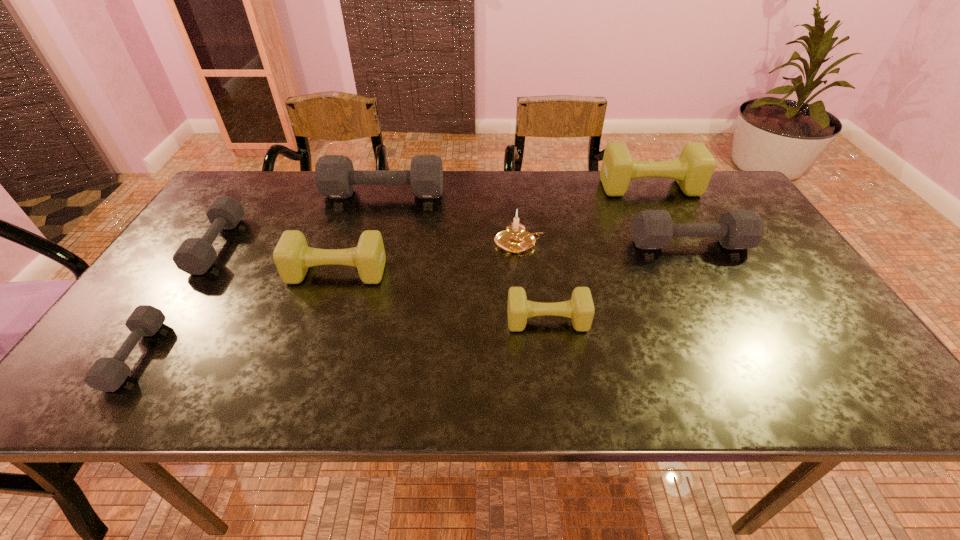
You are a GUI agent. You are given a task and a screenshot of the screen. Output one action in this format:
    pyautogui.click(x=<x>, y=<y>)
    Task: Click on the vacant space situated 0.290m on the right of the nearest gray dumbbell
    The height and width of the screenshot is (540, 960).
    Given the screenshot: What is the action you would take?
    pyautogui.click(x=287, y=355)

Where is `object located in the near edge section of the desktop`? The image size is (960, 540). object located in the near edge section of the desktop is located at coordinates (107, 374).

Find the location of `object at the near left corner`. object at the near left corner is located at coordinates (107, 374).

Locate an element on the screen. The width and height of the screenshot is (960, 540). object at the far right corner is located at coordinates (693, 170).

Identify the location of vacant space at the far edge. This screenshot has width=960, height=540. (563, 200).

The height and width of the screenshot is (540, 960). I want to click on free space at the near edge of the desktop, so click(450, 385).

You are a GUI agent. You are given a task and a screenshot of the screen. Output one action in this format:
    pyautogui.click(x=<x>, y=<y>)
    Task: Click on the free space at the right edge of the desktop
    This screenshot has width=960, height=540.
    Given the screenshot: What is the action you would take?
    pyautogui.click(x=810, y=325)

Find the location of a particular element. The image size is (960, 540). vacant space at the far left corner of the desktop is located at coordinates click(264, 177).

Locate an element on the screen. vacant space that is in between the leftmost olive dumbbell and the candle holder is located at coordinates (427, 258).

Locate an element on the screen. The height and width of the screenshot is (540, 960). vacant area that lies between the biggest olive dumbbell and the shortest dumbbell is located at coordinates (393, 271).